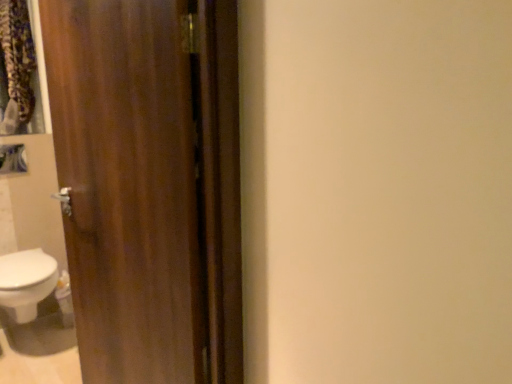
What do you see at coordinates (26, 282) in the screenshot? This screenshot has height=384, width=512. I see `white glossy bidet at lower left` at bounding box center [26, 282].

Where is `white glossy bidet at lower left`? This screenshot has height=384, width=512. white glossy bidet at lower left is located at coordinates (26, 282).

Describe the element at coordinates (149, 185) in the screenshot. Image resolution: width=512 pixels, height=384 pixels. I see `wooden door at left` at that location.

At what (x,y) coordinates should I click in order to perform the action: click on wooden door at left. Please return your answer as a coordinate pair (x, y). The image size is (512, 384). Looking at the image, I should click on (149, 185).

Where is `white glossy bidet at lower left`? white glossy bidet at lower left is located at coordinates (26, 282).

Visually, is wooden door at left positioned to the left or to the right of white glossy bidet at lower left?

In the image, wooden door at left appears on the right side of white glossy bidet at lower left.

Who is more distant, wooden door at left or white glossy bidet at lower left?

white glossy bidet at lower left.

Is point (162, 304) closer or farther from the camera than point (39, 257)?

Point (162, 304) appears to be closer to the viewer than point (39, 257).

From the image's perspective, is wooden door at left beneath white glossy bidet at lower left?

No, from the image's perspective, wooden door at left is not below white glossy bidet at lower left.

Looking at this image, from a real-world perspective, is wooden door at left above or below white glossy bidet at lower left?

Clearly, from a real-world perspective, wooden door at left is above white glossy bidet at lower left.

Looking at their sizes, would you say wooden door at left is wider or thinner than white glossy bidet at lower left?

Considering their sizes, wooden door at left looks slimmer than white glossy bidet at lower left.

Looking at this image, does wooden door at left have a lesser height compared to white glossy bidet at lower left?

A: In fact, wooden door at left may be taller than white glossy bidet at lower left.

Considering the sizes of objects wooden door at left and white glossy bidet at lower left in the image provided, who is smaller, wooden door at left or white glossy bidet at lower left?

Smaller between the two is white glossy bidet at lower left.

Could white glossy bidet at lower left be considered to be inside wooden door at left?

No, white glossy bidet at lower left is not inside wooden door at left.

Are wooden door at left and white glossy bidet at lower left far apart?

Yes, wooden door at left is far from white glossy bidet at lower left.

Is wooden door at left facing towards white glossy bidet at lower left?

No, wooden door at left does not turn towards white glossy bidet at lower left.

Where is `bidet that appears below the wooden door at left (from the image's perspective)`? bidet that appears below the wooden door at left (from the image's perspective) is located at coordinates (26, 282).

Is white glossy bidet at lower left to the right of wooden door at left from the viewer's perspective?

Incorrect, white glossy bidet at lower left is not on the right side of wooden door at left.

Is white glossy bidet at lower left in front of or behind wooden door at left in the image?

white glossy bidet at lower left is behind wooden door at left.

Considering the positions of point (55, 267) and point (206, 114), is point (55, 267) closer or farther from the camera than point (206, 114)?

Point (55, 267) is farther from the camera than point (206, 114).

Looking at this image, from the image's perspective, between white glossy bidet at lower left and wooden door at left, who is located below?

white glossy bidet at lower left, from the image's perspective.

From a real-world perspective, is white glossy bidet at lower left physically located above or below wooden door at left?

white glossy bidet at lower left is situated lower than wooden door at left in the real world.

Which of these two, white glossy bidet at lower left or wooden door at left, is thinner?

Thinner between the two is wooden door at left.

Considering the sizes of objects white glossy bidet at lower left and wooden door at left in the image provided, who is taller, white glossy bidet at lower left or wooden door at left?

With more height is wooden door at left.

Between white glossy bidet at lower left and wooden door at left, which one has larger size?

With larger size is wooden door at left.

Do you think white glossy bidet at lower left is within wooden door at left, or outside of it?

white glossy bidet at lower left is spatially situated outside wooden door at left.

Is white glossy bidet at lower left not near wooden door at left?

Yes, white glossy bidet at lower left and wooden door at left are located far from each other.

Is white glossy bidet at lower left facing away from wooden door at left?

white glossy bidet at lower left is not turned away from wooden door at left.

Find the location of a particular element. The height and width of the screenshot is (384, 512). door that is above the white glossy bidet at lower left (from the image's perspective) is located at coordinates [x=149, y=185].

The width and height of the screenshot is (512, 384). What are the coordinates of `door located in front of the white glossy bidet at lower left` in the screenshot? It's located at (149, 185).

Identify the location of bidet below the wooden door at left (from the image's perspective). (26, 282).